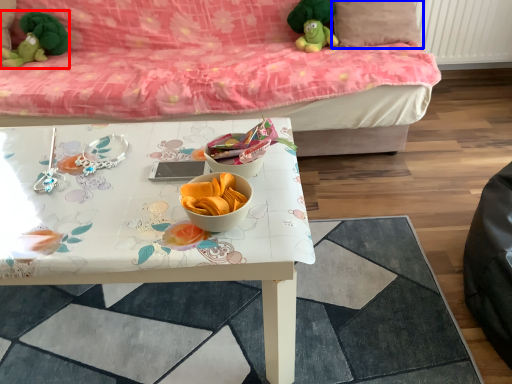
Question: Which point is closer to the camera, toy (highlighted by a red box) or pillow (highlighted by a blue box)?

Choices:
 (A) toy
 (B) pillow

Answer: (B)